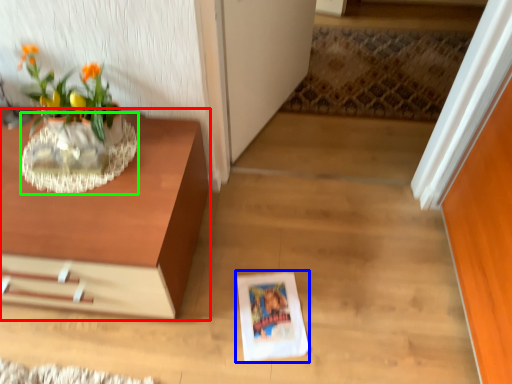
Question: Estimate the real-world distances between objects in this image. Which object is closer to table (highlighted by a red box), paperback book (highlighted by a blue box) or vase (highlighted by a green box)?

Choices:
 (A) paperback book
 (B) vase

Answer: (B)